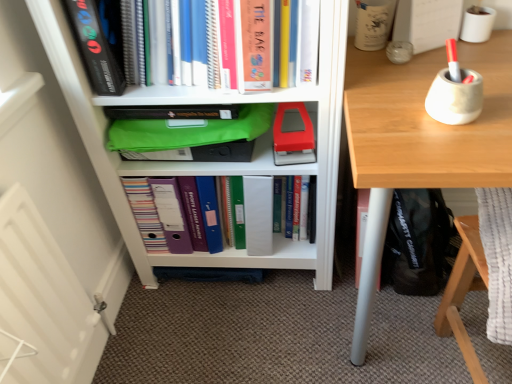
This screenshot has height=384, width=512. I want to click on vacant space positioned to the left of matte gray pen holder at upper right, which is the 3th stationery from left to right, so click(384, 126).